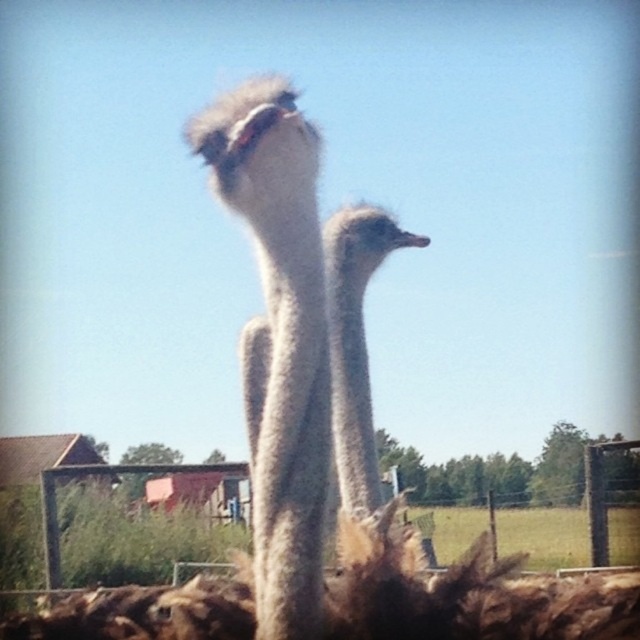
You are an ornithologist observing two ostriches in a rural area. You notice the white feathered ostrich at center and the white fluffy head at upper center. Which of these two objects is closer to you?

The white feathered ostrich at center is closer to you than the white fluffy head at upper center.

You are a birdwatcher trying to photograph the white fluffy head at upper center and the metal wire fence at center. Which object is taller in the image?

The metal wire fence at center is much taller than the white fluffy head at upper center.